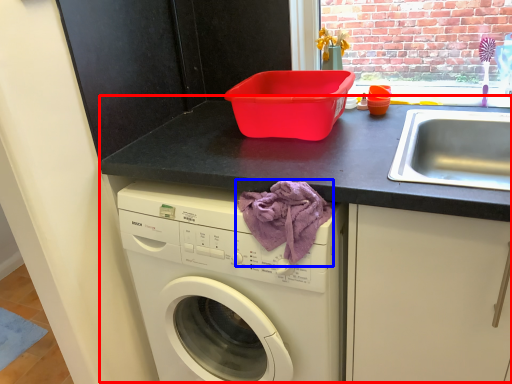
Question: Which point is closer to the camera, counter (highlighted by a red box) or blanket (highlighted by a blue box)?

Choices:
 (A) counter
 (B) blanket

Answer: (A)